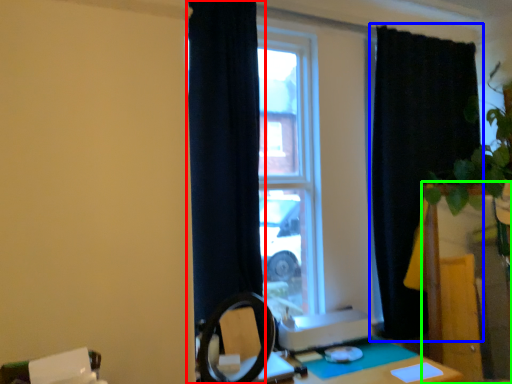
Question: Estimate the real-world distances between objects in this image. Which object is closer to curtain (highlighted by a red box), curtain (highlighted by a blue box) or vanity (highlighted by a green box)?

Choices:
 (A) curtain
 (B) vanity

Answer: (A)